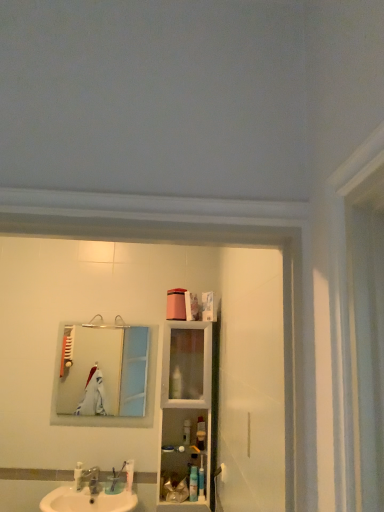
Question: In the image, is silver metallic mirror at upper left positioned in front of or behind white glossy sink at lower left?

Choices:
 (A) front
 (B) behind

Answer: (B)

Question: Looking at the image, does silver metallic mirror at upper left seem bigger or smaller compared to white glossy sink at lower left?

Choices:
 (A) small
 (B) big

Answer: (A)

Question: Estimate the real-world distances between objects in this image. Which object is closer to the translucent plastic container at center, which is the 2th toiletry in left-to-right order?

Choices:
 (A) blue plastic toothbrush at lower center, the 1th toiletry from the right
 (B) white plastic toothbrush at lower center
 (C) silver metallic mirror at upper left
 (D) blue plastic toothpaste tube at lower center, marked as the 3th toiletry in a right-to-left arrangement
 (E) translucent plastic bottle at lower center, the fourth toiletry in the left-to-right sequence

Answer: (E)

Question: Considering the real-world distances, which object is closest to the white plastic toothbrush at lower center?

Choices:
 (A) blue plastic toothbrush at lower center, the fifth toiletry when ordered from left to right
 (B) silver metallic mirror at upper left
 (C) translucent plastic container at center, the fourth toiletry positioned from the right
 (D) white glossy sink at lower left
 (E) blue plastic toothpaste tube at lower center, marked as the 3th toiletry in a right-to-left arrangement

Answer: (D)